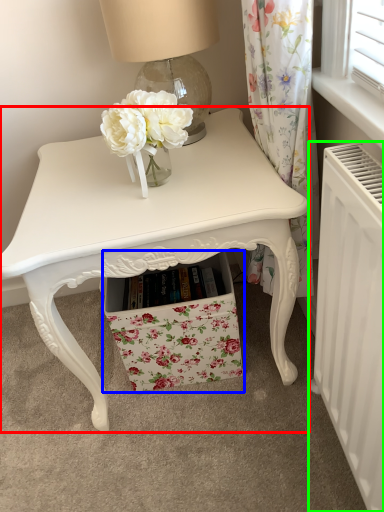
Question: Considering the real-world distances, which object is closest to table (highlighted by a red box)? drawer (highlighted by a blue box) or radiator (highlighted by a green box).

Choices:
 (A) drawer
 (B) radiator

Answer: (A)